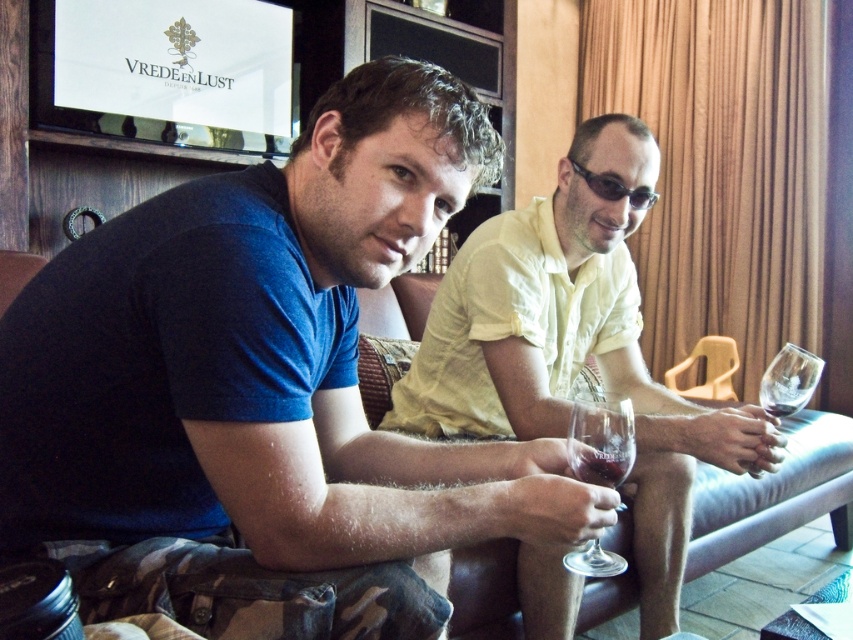
Which is in front, point (589, 172) or point (770, 408)?

Point (770, 408) is in front.

Does sunglasses at center appear on the right side of dark red glass at right?

Incorrect, sunglasses at center is not on the right side of dark red glass at right.

The width and height of the screenshot is (853, 640). I want to click on sunglasses at center, so click(614, 188).

This screenshot has width=853, height=640. What are the coordinates of `sunglasses at center` in the screenshot? It's located at (614, 188).

Can you confirm if blue cotton t-shirt at left is smaller than matte yellow shirt at center?

Yes, blue cotton t-shirt at left is smaller than matte yellow shirt at center.

Where is `blue cotton t-shirt at left`? This screenshot has width=853, height=640. blue cotton t-shirt at left is located at coordinates (263, 390).

Is point (397, 77) more distant than point (495, 378)?

No, it is in front of (495, 378).

Identify the location of blue cotton t-shirt at left. This screenshot has height=640, width=853. (263, 390).

Between transparent glass wine at lower center and sunglasses at center, which one appears on the right side from the viewer's perspective?

sunglasses at center is more to the right.

The height and width of the screenshot is (640, 853). In order to click on transparent glass wine at lower center in this screenshot , I will do `click(601, 440)`.